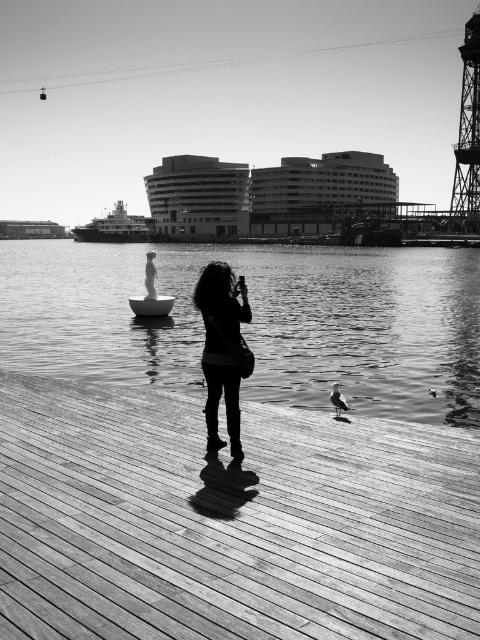
Between wooden at center and transparent water at center, which one has less height?

wooden at center

Measure the distance between wooden at center and camera.

24.80 feet

At what (x,y) coordinates should I click in order to perform the action: click on wooden at center. Please return your answer as a coordinate pair (x, y). This screenshot has height=640, width=480. Looking at the image, I should click on (229, 522).

Who is higher up, silky black hair at center or metallic ship at center?

metallic ship at center is above.

In order to click on silky black hair at center in this screenshot , I will do `click(223, 349)`.

Can you confirm if transparent water at center is smaller than silky black hair at center?

Actually, transparent water at center might be larger than silky black hair at center.

Between transparent water at center and silky black hair at center, which one appears on the right side from the viewer's perspective?

Positioned to the right is transparent water at center.

Find the location of `transparent water at center`. transparent water at center is located at coordinates 257,321.